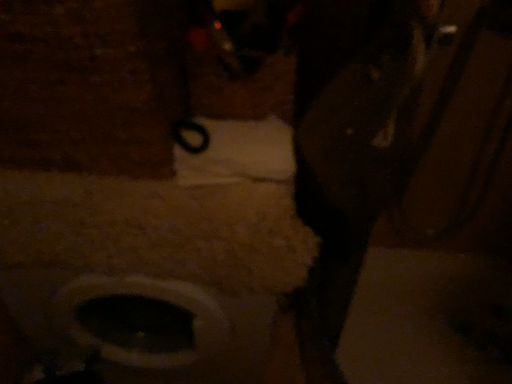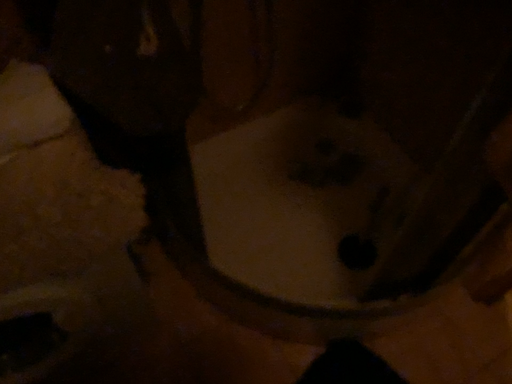
Question: Which way did the camera rotate in the video?

Choices:
 (A) rotated downward
 (B) rotated upward

Answer: (A)